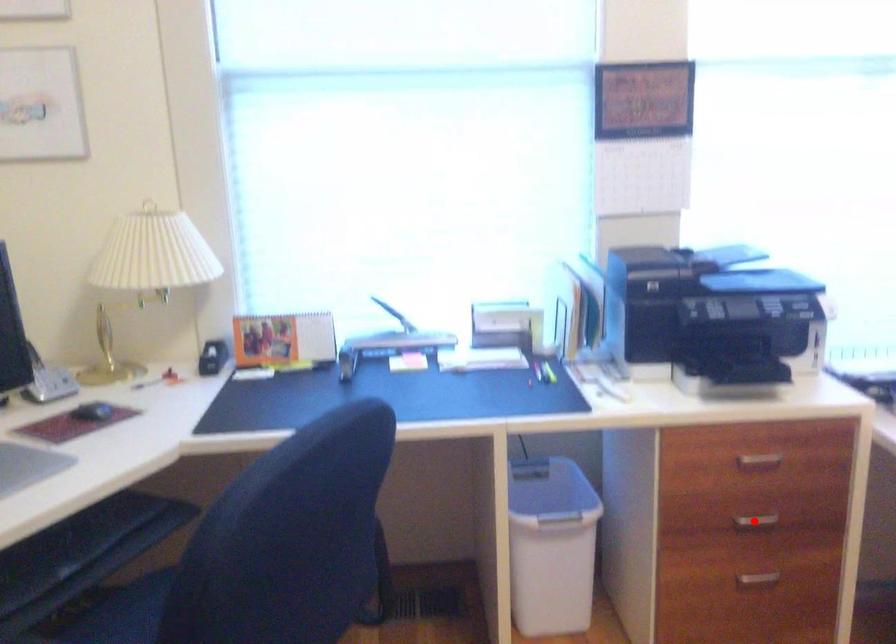
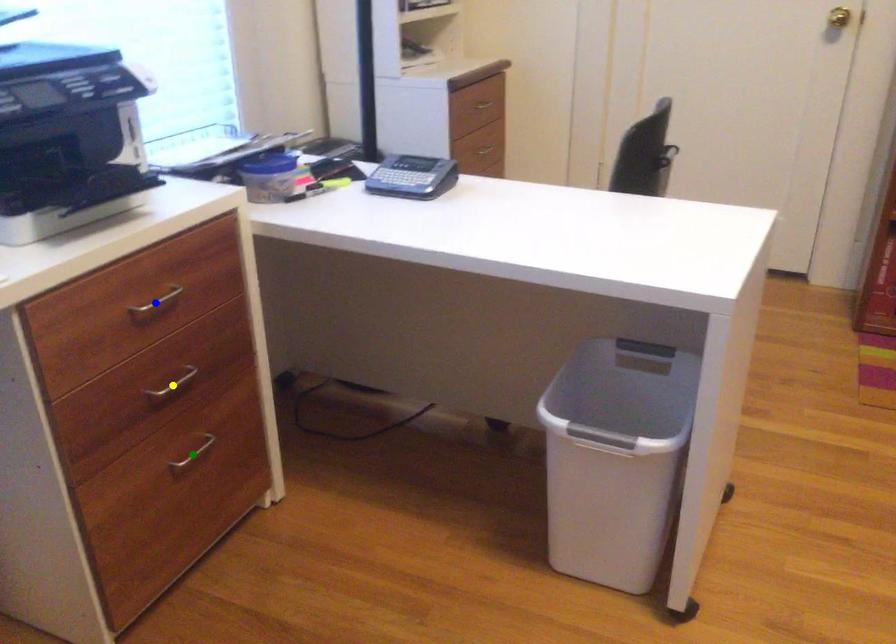
Question: I am providing you with two images of the same scene from different viewpoints. A red point is marked on the first image. You are given multiple points on the second image. Which spot in image 2 lines up with the point in image 1?

Choices:
 (A) green point
 (B) blue point
 (C) yellow point

Answer: (C)